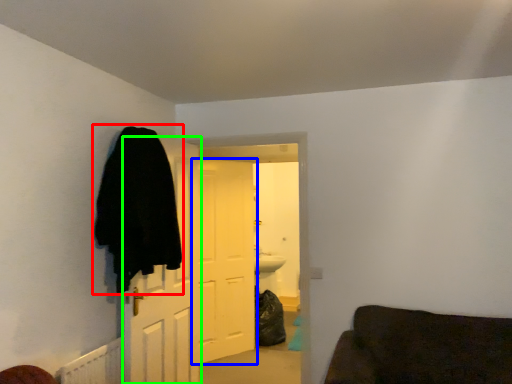
Question: Considering the real-world distances, which object is farthest from cloak (highlighted by a red box)? door (highlighted by a blue box) or door (highlighted by a green box)?

Choices:
 (A) door
 (B) door

Answer: (A)